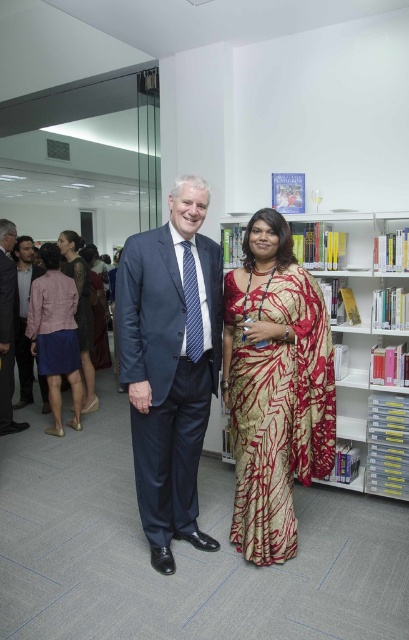
Does gold silk saree at center lie behind metallic silver bookcase at upper right?

No, it is not.

Is point (269, 516) less distant than point (402, 275)?

Yes.

You are a GUI agent. You are given a task and a screenshot of the screen. Output one action in this format:
    pyautogui.click(x=<x>, y=<y>)
    Task: Click on the gold silk saree at center
    
    Given the screenshot: What is the action you would take?
    pyautogui.click(x=278, y=406)

This screenshot has height=640, width=409. What do you see at coordinates (278, 406) in the screenshot? I see `gold silk saree at center` at bounding box center [278, 406].

Can you confirm if gold silk saree at center is wider than dark blue suit at left?

Indeed, gold silk saree at center has a greater width compared to dark blue suit at left.

The image size is (409, 640). Find the location of `gold silk saree at center`. gold silk saree at center is located at coordinates (278, 406).

Is metallic silver bookcase at upper right positioned in front of dark blue suit at left?

Yes, it is in front of dark blue suit at left.

Who is more forward, (x=296, y=237) or (x=2, y=220)?

Point (x=296, y=237) is more forward.

Is point (339, 250) closer to camera compared to point (15, 227)?

Yes, point (339, 250) is closer to viewer.

I want to click on metallic silver bookcase at upper right, so click(x=361, y=344).